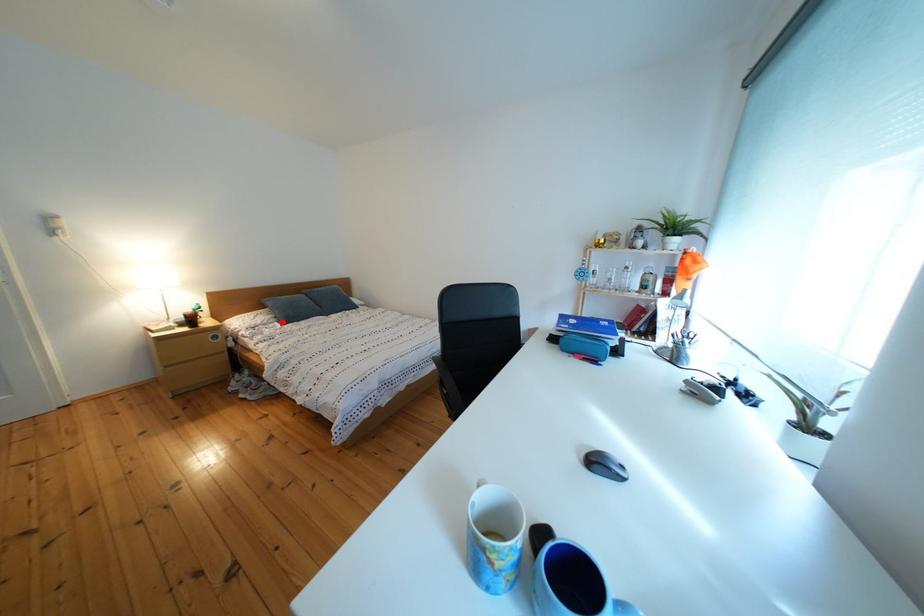
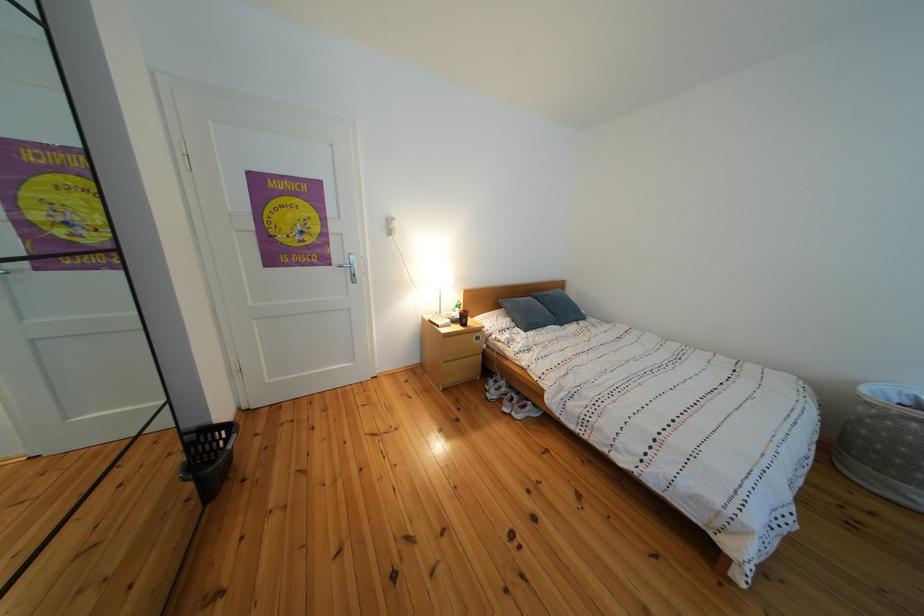
Question: I am providing you with two images of the same scene from different viewpoints. A red point is shown in image1. For the corresponding object point in image2, is it positioned nearer or farther from the camera?

Choices:
 (A) Nearer
 (B) Farther

Answer: (B)